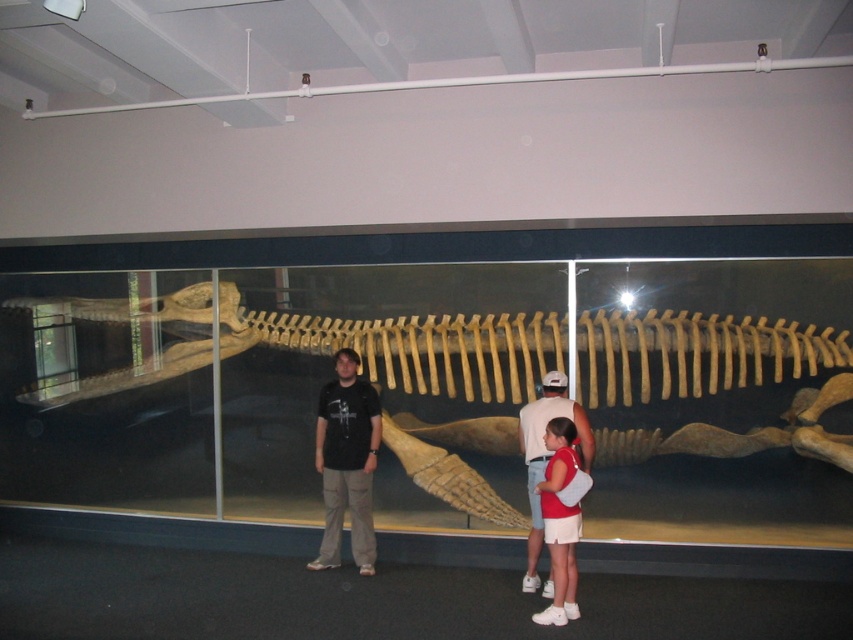
Who is taller, matte black t-shirt at center or white cotton shirt at center?

matte black t-shirt at center is taller.

Which of these two, matte black t-shirt at center or white cotton shirt at center, stands shorter?

Standing shorter between the two is white cotton shirt at center.

This screenshot has height=640, width=853. Find the location of `matte black t-shirt at center`. matte black t-shirt at center is located at coordinates (347, 461).

Does bone-like skeleton at center have a greater height compared to matte black t-shirt at center?

Incorrect, bone-like skeleton at center's height is not larger of matte black t-shirt at center's.

Who is more distant from viewer, [480,508] or [346,380]?

Point [480,508]

Find the location of `bone-like skeleton at center`. bone-like skeleton at center is located at coordinates (558, 397).

Which is behind, point (155, 412) or point (578, 433)?

Positioned behind is point (155, 412).

Is point (701, 307) positioned after point (592, 440)?

Yes, it is.

Which is in front, point (766, 472) or point (549, 390)?

Point (549, 390)

The height and width of the screenshot is (640, 853). In order to click on bone-like skeleton at center in this screenshot , I will do 558,397.